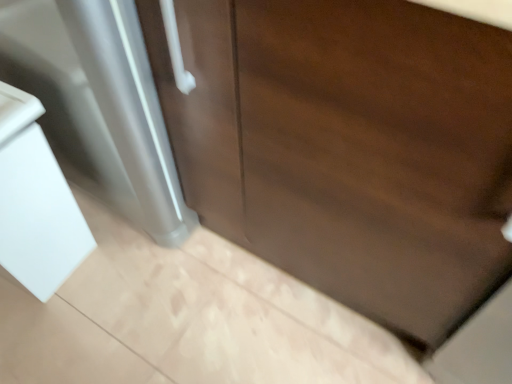
Question: Based on their sizes in the image, would you say dark wood door at center is bigger or smaller than white glossy sink at lower left?

Choices:
 (A) small
 (B) big

Answer: (B)

Question: Considering the positions of dark wood door at center and white glossy sink at lower left in the image, is dark wood door at center wider or thinner than white glossy sink at lower left?

Choices:
 (A) wide
 (B) thin

Answer: (A)

Question: Considering their positions, is dark wood door at center located in front of or behind white glossy sink at lower left?

Choices:
 (A) front
 (B) behind

Answer: (A)

Question: From a real-world perspective, is white glossy sink at lower left positioned above or below dark wood door at center?

Choices:
 (A) above
 (B) below

Answer: (B)

Question: From their relative heights in the image, would you say white glossy sink at lower left is taller or shorter than dark wood door at center?

Choices:
 (A) short
 (B) tall

Answer: (A)

Question: Is point (28, 205) closer or farther from the camera than point (232, 119)?

Choices:
 (A) closer
 (B) farther

Answer: (B)

Question: Would you say white glossy sink at lower left is to the left or to the right of dark wood door at center in the picture?

Choices:
 (A) left
 (B) right

Answer: (A)